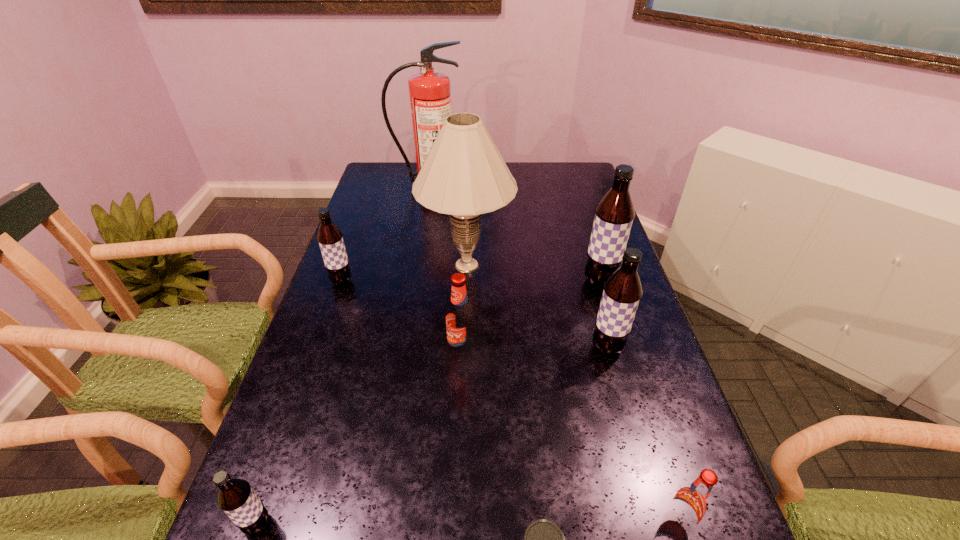
You are a GUI agent. You are given a task and a screenshot of the screen. Output one action in this format:
    pyautogui.click(x=<x>, y=<y>)
    Task: Click on the nearest brown root beer
    Image resolution: width=960 pixels, height=540 pixels.
    Given the screenshot: What is the action you would take?
    pyautogui.click(x=236, y=498)

Find the location of a particular element. The width and height of the screenshot is (960, 540). the right red root beer is located at coordinates (690, 504).

The width and height of the screenshot is (960, 540). In order to click on the smaller red root beer in this screenshot , I will do `click(690, 504)`.

This screenshot has width=960, height=540. Identify the location of vacant area situated 0.260m on the front-facing side of the fire extinguisher. (420, 236).

Find the location of a particular element. The height and width of the screenshot is (540, 960). blank space located 0.090m on the back of the lampshade is located at coordinates (468, 222).

The image size is (960, 540). Find the location of `vacant space located 0.190m on the front of the tallest root beer`. vacant space located 0.190m on the front of the tallest root beer is located at coordinates (619, 346).

You are a GUI agent. You are given a task and a screenshot of the screen. Output one action in this format:
    pyautogui.click(x=<x>, y=<y>)
    Task: Click on the free space located 0.200m on the back of the third farthest brown root beer
    This screenshot has height=540, width=960.
    Given the screenshot: What is the action you would take?
    coord(588,283)

Where is `vacant space located 0.110m on the back of the second smallest brown root beer`? vacant space located 0.110m on the back of the second smallest brown root beer is located at coordinates (352, 251).

Locate an element on the screen. free location located 0.280m on the right of the fourth root beer from right to left is located at coordinates pyautogui.click(x=589, y=351).

You are a GUI agent. You are given a task and a screenshot of the screen. Output one action in this format:
    pyautogui.click(x=<x>, y=<y>)
    Task: Click on the free space located 0.120m on the right of the nearest brown root beer
    The width and height of the screenshot is (960, 540).
    Given the screenshot: What is the action you would take?
    pyautogui.click(x=339, y=524)